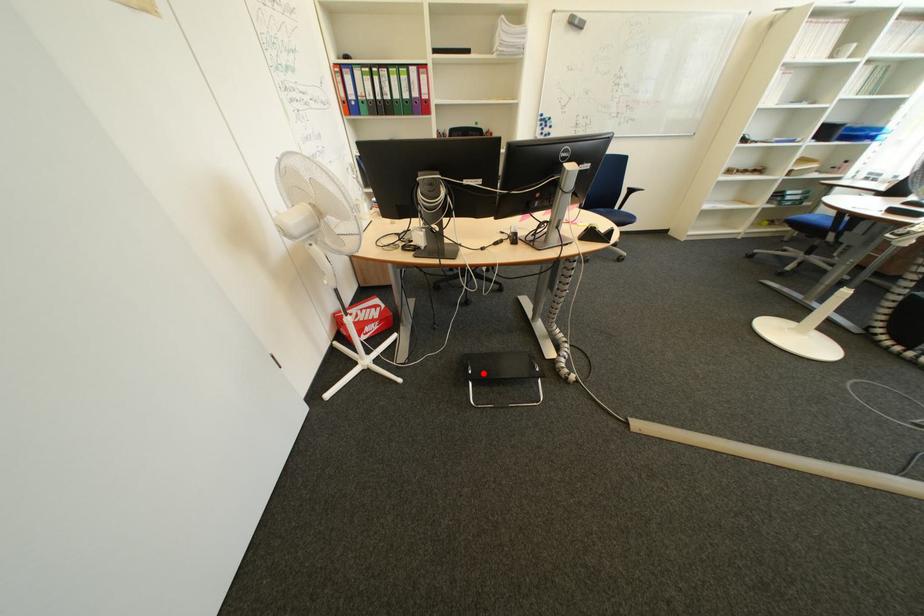
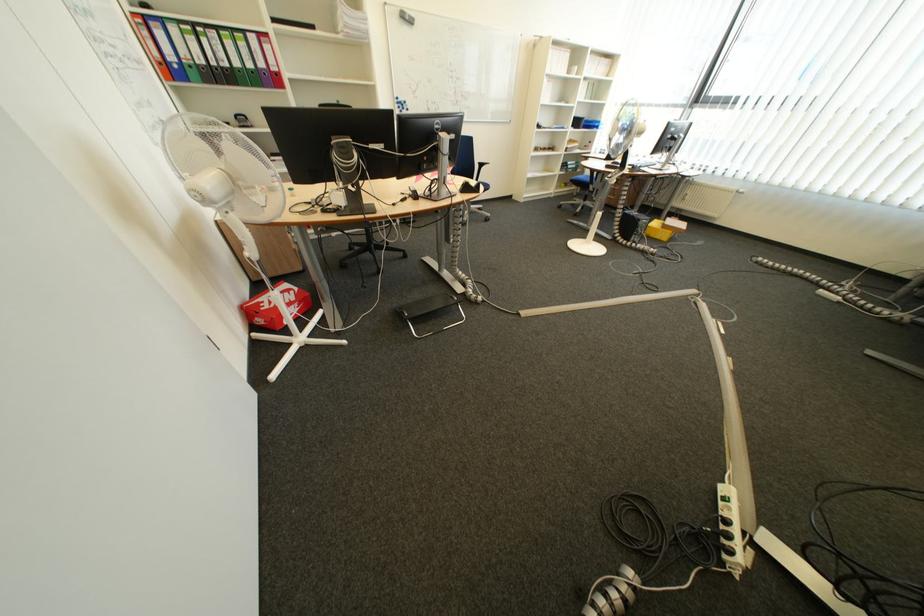
Find the pixel in the second image that matches the highlighted location in the first image.

(419, 315)